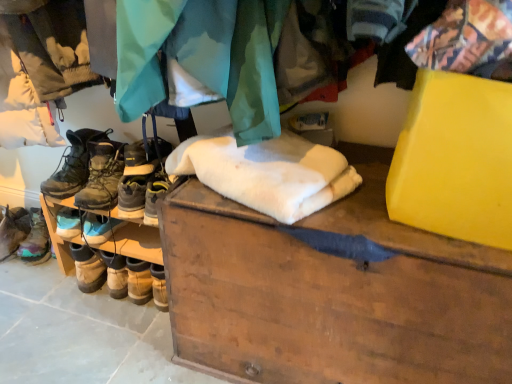
Question: Would you say leather hiking boots at left, which is counted as the 2th footwear, starting from the right, is to the left or to the right of leather boots at left, acting as the 4th footwear starting from the right, in the picture?

Choices:
 (A) right
 (B) left

Answer: (A)

Question: Considering the positions of point (93, 147) and point (28, 254), is point (93, 147) closer or farther from the camera than point (28, 254)?

Choices:
 (A) farther
 (B) closer

Answer: (B)

Question: Estimate the real-world distances between objects in this image. Which object is farther from the leather boots at left, arranged as the first footwear when viewed from the left?

Choices:
 (A) white fluffy blanket at center
 (B) leather boots at left, marked as the 2th footwear in a left-to-right arrangement
 (C) leather hiking boots at center, placed as the 1th footwear when sorted from right to left
 (D) wooden chest at center
 (E) leather hiking boots at left, which is counted as the 2th footwear, starting from the right

Answer: (D)

Question: Based on their relative distances, which object is nearer to the leather boots at left, arranged as the first footwear when viewed from the left?

Choices:
 (A) leather boots at left, acting as the third footwear starting from the right
 (B) white fluffy blanket at center
 (C) leather hiking boots at left, the 3th footwear positioned from the left
 (D) leather hiking boots at center, which is the fourth footwear in left-to-right order
 (E) wooden chest at center

Answer: (A)